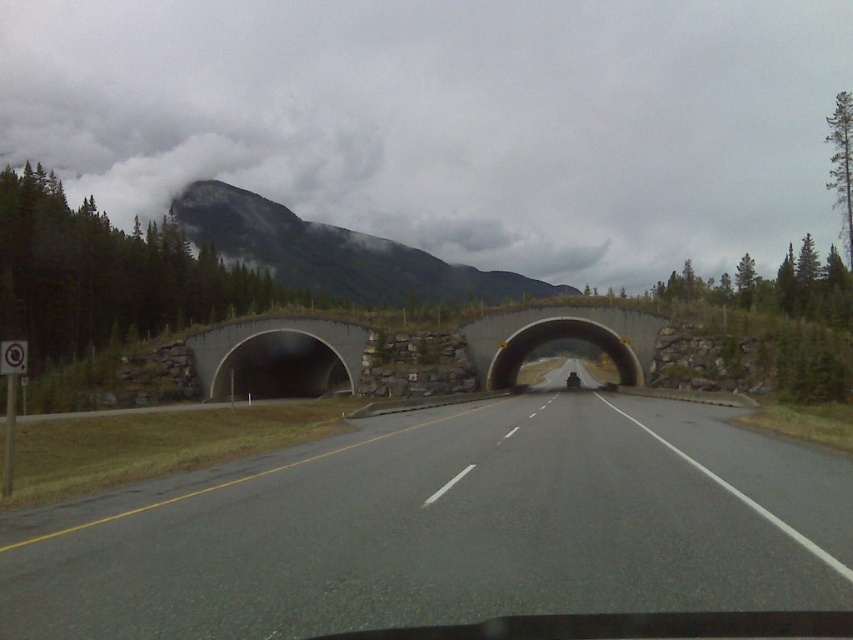
Is point (741, 472) farther from viewer compared to point (625, 374)?

No, it is not.

Does gray asphalt road at center have a larger size compared to concrete at center?

Yes, gray asphalt road at center is bigger than concrete at center.

Who is more forward, (x=592, y=435) or (x=604, y=332)?

Positioned in front is point (x=592, y=435).

Where is `gray asphalt road at center`? Image resolution: width=853 pixels, height=640 pixels. gray asphalt road at center is located at coordinates (447, 528).

Can you confirm if gray concrete tunnel at center is positioned to the right of concrete at center?

Incorrect, gray concrete tunnel at center is not on the right side of concrete at center.

Who is taller, gray concrete tunnel at center or concrete at center?

gray concrete tunnel at center

At what (x,y) coordinates should I click in order to perform the action: click on gray concrete tunnel at center. Please return your answer as a coordinate pair (x, y). This screenshot has height=640, width=853. Looking at the image, I should click on (277, 356).

Does gray asphalt road at center have a greater height compared to rocky gray mountain at upper center?

Incorrect, gray asphalt road at center's height is not larger of rocky gray mountain at upper center's.

Measure the distance between point (747, 502) and camera.

The distance of point (747, 502) from camera is 10.18 meters.

Who is more forward, (192, 483) or (241, 189)?

Point (192, 483)

The image size is (853, 640). I want to click on gray asphalt road at center, so click(x=447, y=528).